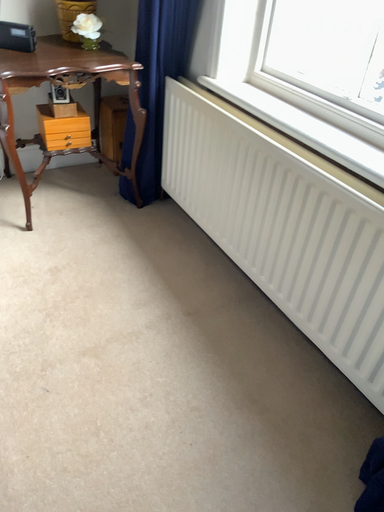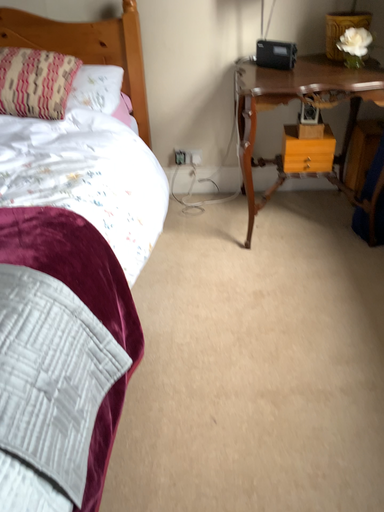
Question: How did the camera likely rotate when shooting the video?

Choices:
 (A) rotated left
 (B) rotated right

Answer: (A)